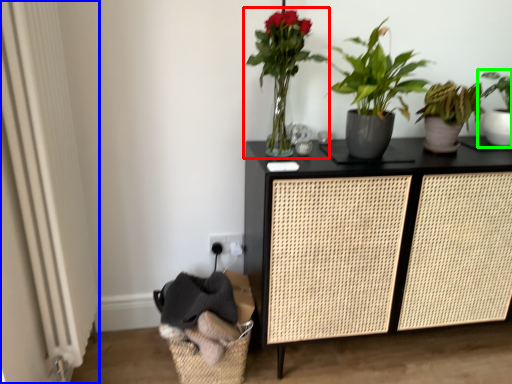
Question: Estimate the real-world distances between objects in this image. Which object is farther from houseplant (highlighted by a red box), screen door (highlighted by a blue box) or houseplant (highlighted by a green box)?

Choices:
 (A) screen door
 (B) houseplant

Answer: (B)